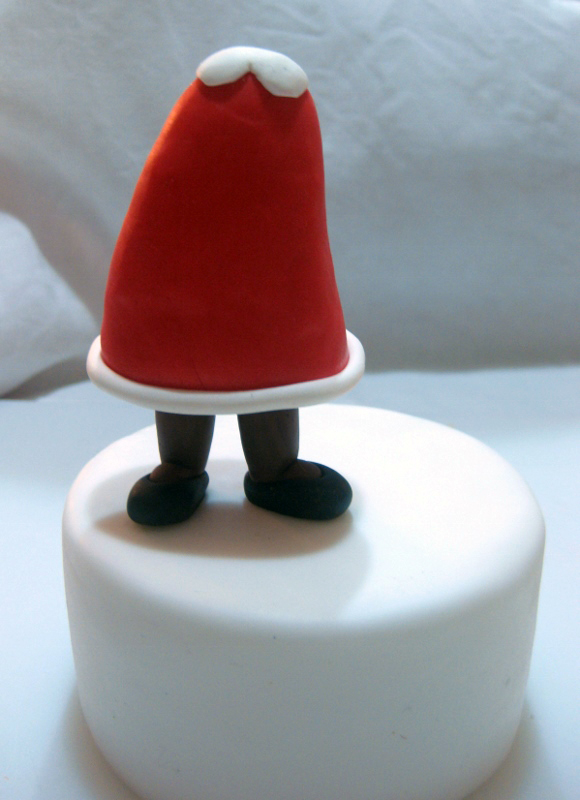
Locate an element on the screen. This screenshot has width=580, height=800. pillow is located at coordinates (12, 310).